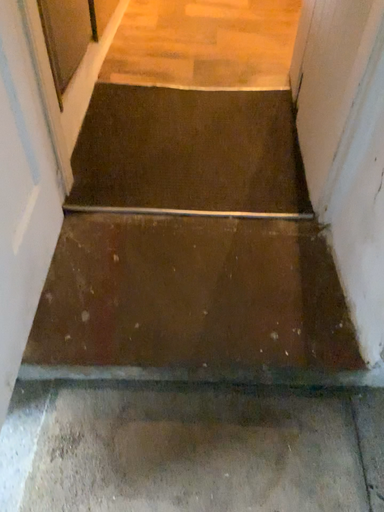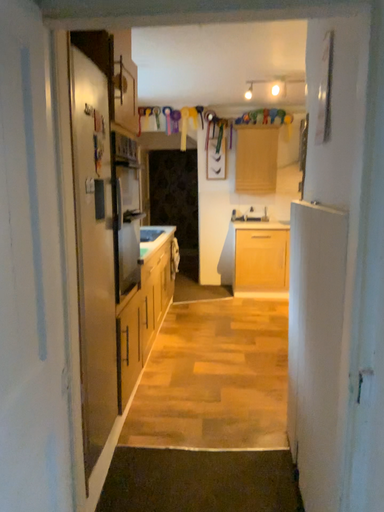
Question: How did the camera likely rotate when shooting the video?

Choices:
 (A) rotated downward
 (B) rotated upward

Answer: (B)